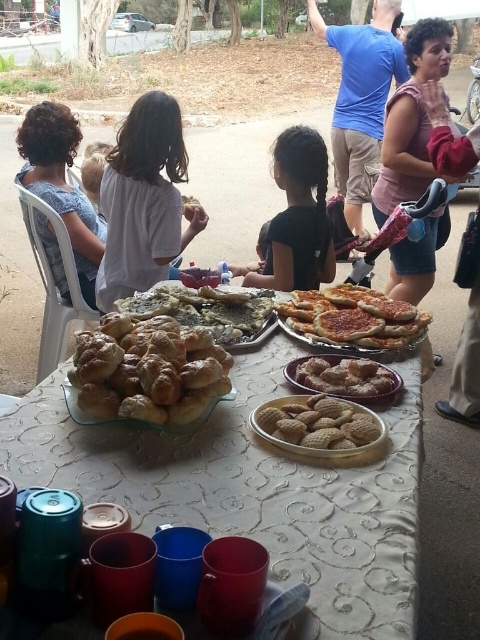
Question: Is matte glass tray at center closer to the viewer compared to blue cotton shirt at upper center?

Choices:
 (A) no
 (B) yes

Answer: (B)

Question: Which object is the closest to the golden brown crumbly pastry at center?

Choices:
 (A) golden crispy pizza at center
 (B) pink fleece jacket at upper right
 (C) blue cotton shirt at upper center
 (D) matte glass tray at center

Answer: (A)

Question: Among these points, which one is nearest to the camera?

Choices:
 (A) (249, 284)
 (B) (172, 224)
 (C) (334, 404)

Answer: (C)

Question: Does blue denim shirt at left appear on the left side of golden crispy pizza at center?

Choices:
 (A) no
 (B) yes

Answer: (B)

Question: Is golden crispy pizza at center positioned before golden brown crumbly pastry at center?

Choices:
 (A) no
 (B) yes

Answer: (A)

Question: Which point appears closest to the camera in this image?

Choices:
 (A) pyautogui.click(x=76, y=246)
 (B) pyautogui.click(x=181, y=422)
 (C) pyautogui.click(x=149, y=310)

Answer: (B)